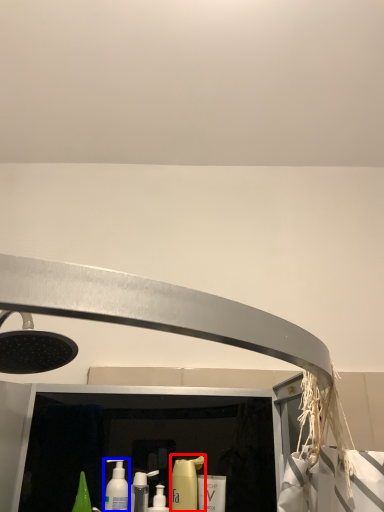
Question: Which point is further to the camera, cleaning product (highlighted by a red box) or mouthwash (highlighted by a blue box)?

Choices:
 (A) cleaning product
 (B) mouthwash

Answer: (A)